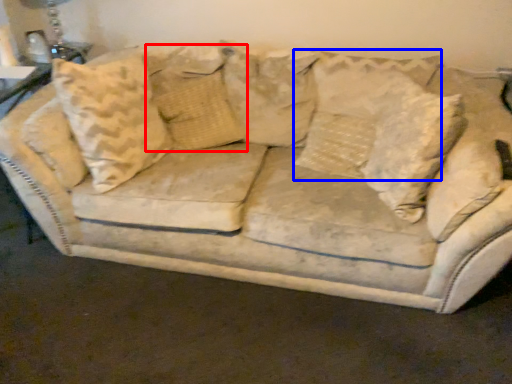
Question: Which of the following is the closest to the observer, pillow (highlighted by a red box) or pillow (highlighted by a blue box)?

Choices:
 (A) pillow
 (B) pillow

Answer: (B)